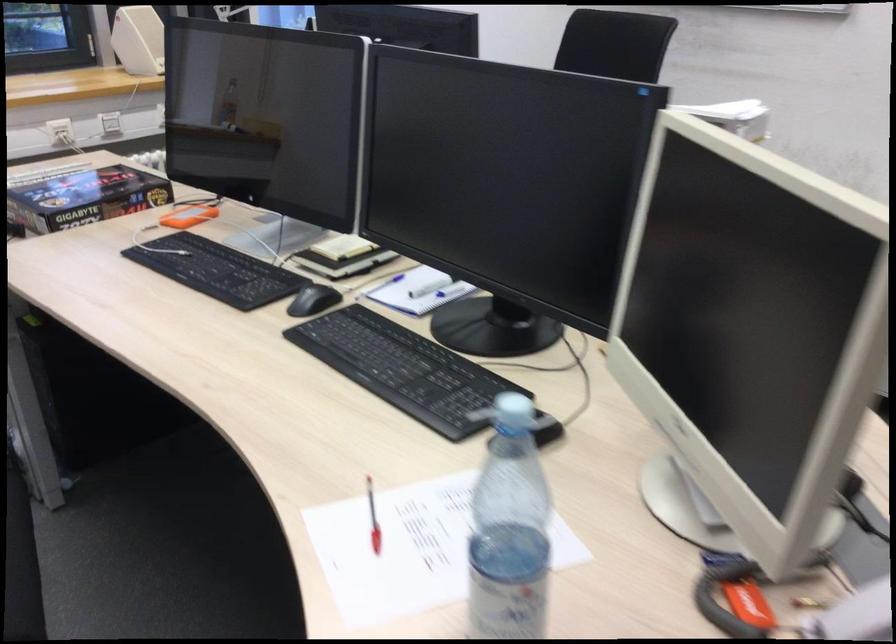
Where would you twist the blue bottle cap? Please return your answer as a coordinate pair (x, y).

(513, 410)